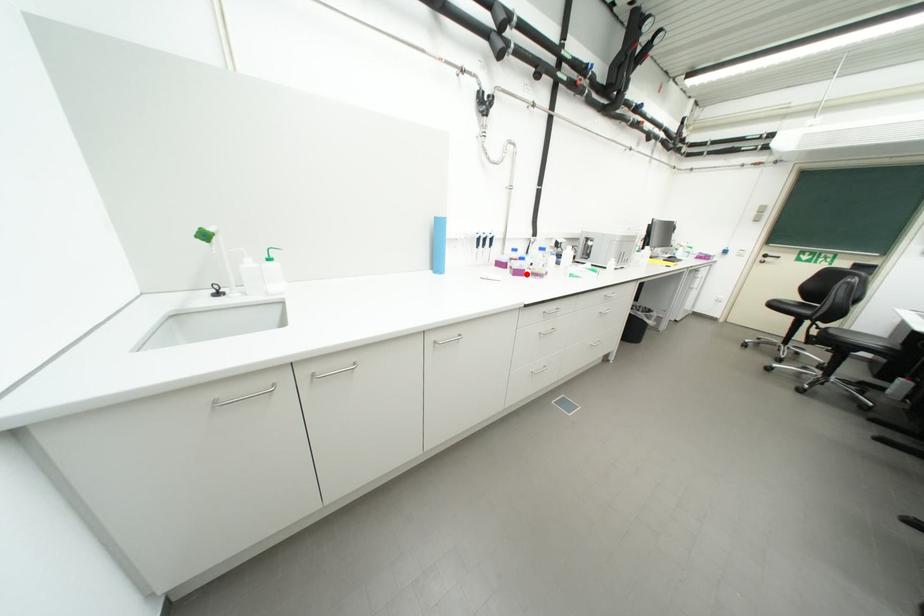
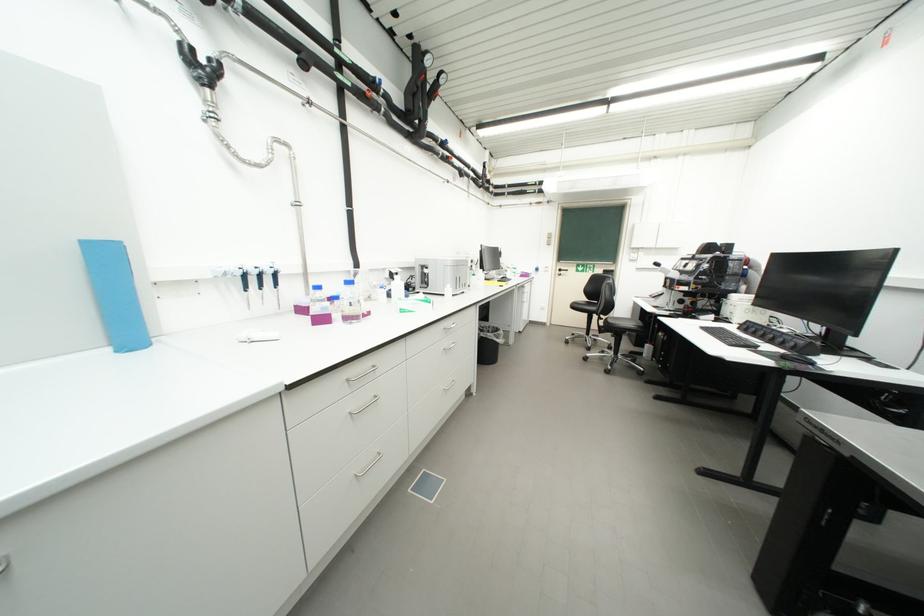
Where in the second image is the point corresponding to the highlighted location from the first image?

(330, 321)